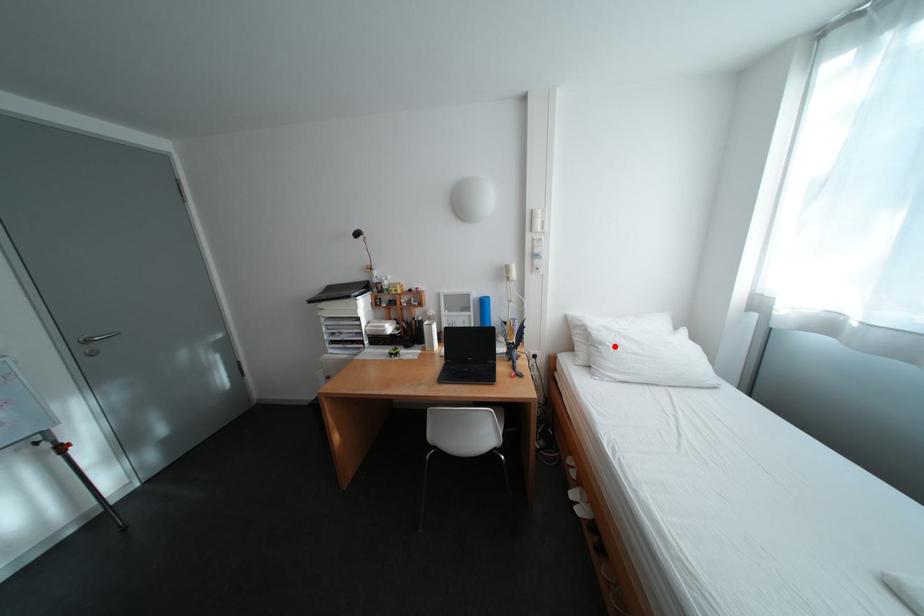
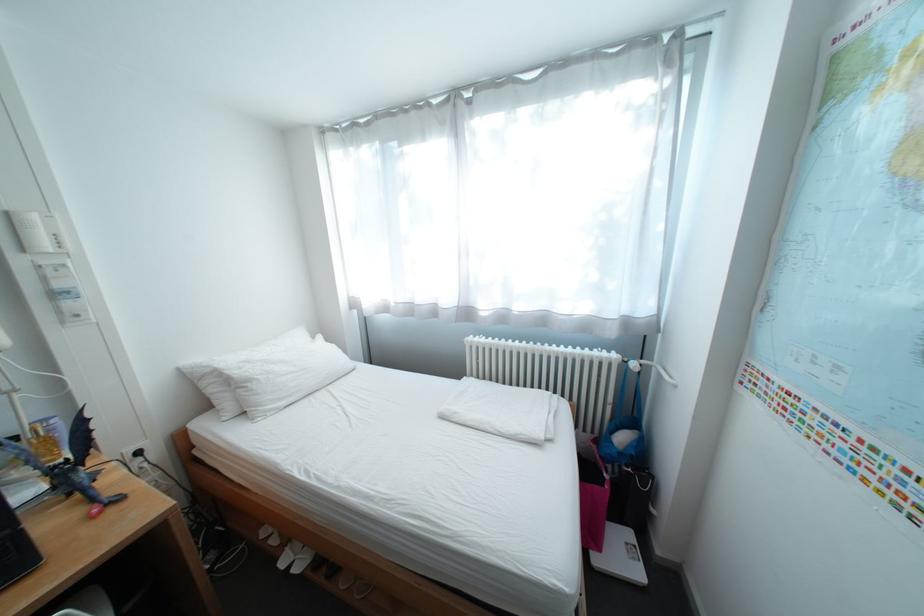
The point at the highlighted location is marked in the first image. Where is the corresponding point in the second image?

(263, 383)